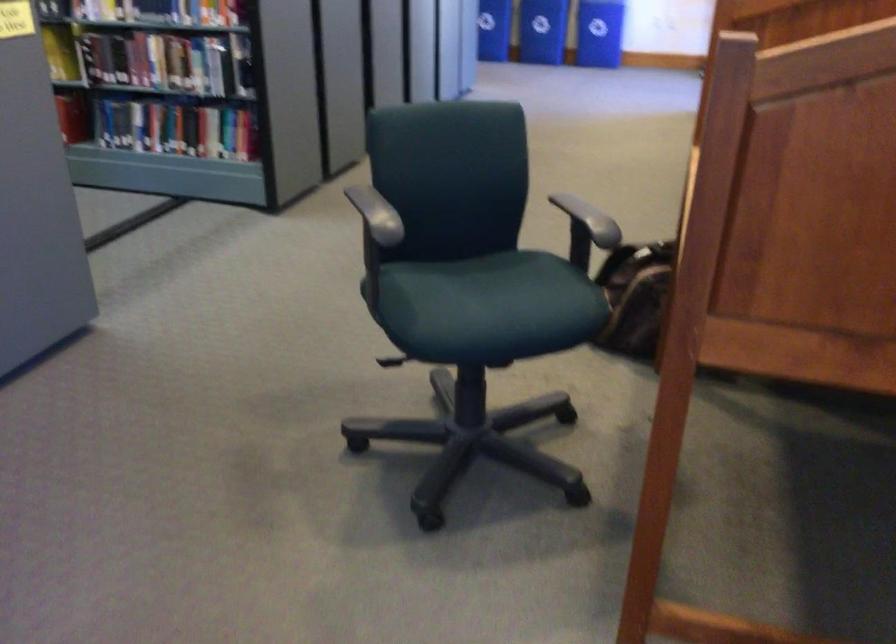
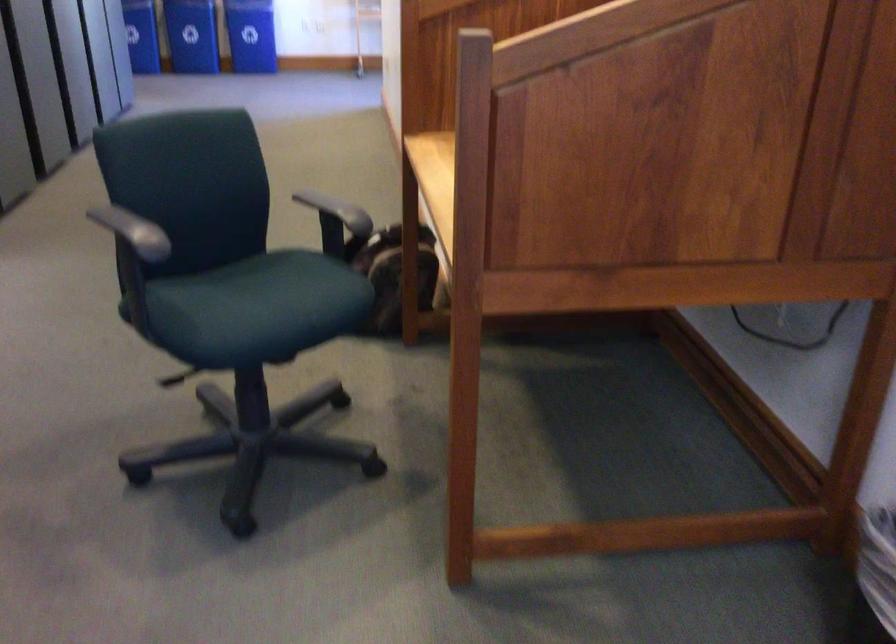
In the second image, find the point that corresponds to point (503, 294) in the first image.

(277, 295)